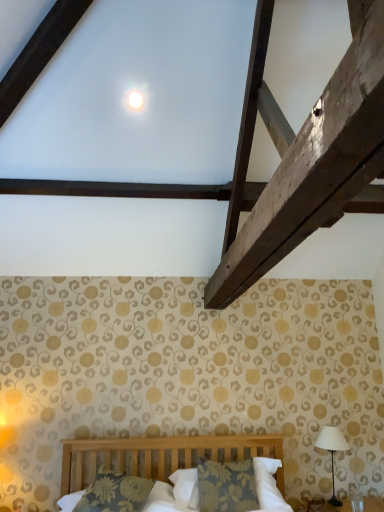
Question: Considering the relative sizes of white glossy moonlight at upper center and floral-patterned fabric pillow at center, the 1th pillow from the left, in the image provided, is white glossy moonlight at upper center wider than floral-patterned fabric pillow at center, the 1th pillow from the left,?

Choices:
 (A) yes
 (B) no

Answer: (B)

Question: Does white glossy moonlight at upper center have a smaller size compared to floral-patterned fabric pillow at center, positioned as the second pillow in right-to-left order?

Choices:
 (A) no
 (B) yes

Answer: (B)

Question: Is white glossy moonlight at upper center looking in the opposite direction of floral-patterned fabric pillow at center, positioned as the second pillow in right-to-left order?

Choices:
 (A) no
 (B) yes

Answer: (A)

Question: Is floral-patterned fabric pillow at center, positioned as the second pillow in right-to-left order, a part of white glossy moonlight at upper center?

Choices:
 (A) yes
 (B) no

Answer: (B)

Question: Is white glossy moonlight at upper center shorter than floral-patterned fabric pillow at center, positioned as the second pillow in right-to-left order?

Choices:
 (A) yes
 (B) no

Answer: (A)

Question: Considering the relative positions of white glossy moonlight at upper center and white fabric-covered lampshade at right in the image provided, is white glossy moonlight at upper center to the left or to the right of white fabric-covered lampshade at right?

Choices:
 (A) right
 (B) left

Answer: (B)

Question: Which is correct: white glossy moonlight at upper center is inside white fabric-covered lampshade at right, or outside of it?

Choices:
 (A) outside
 (B) inside

Answer: (A)

Question: Looking at the image, does white glossy moonlight at upper center seem bigger or smaller compared to white fabric-covered lampshade at right?

Choices:
 (A) small
 (B) big

Answer: (A)

Question: In terms of height, does white glossy moonlight at upper center look taller or shorter compared to white fabric-covered lampshade at right?

Choices:
 (A) tall
 (B) short

Answer: (B)

Question: From a real-world perspective, is white fabric-covered lampshade at right above or below floral fabric pillow at center, marked as the first pillow in a right-to-left arrangement?

Choices:
 (A) below
 (B) above

Answer: (B)

Question: Looking at the image, does white fabric-covered lampshade at right seem bigger or smaller compared to floral fabric pillow at center, marked as the first pillow in a right-to-left arrangement?

Choices:
 (A) small
 (B) big

Answer: (A)

Question: Is white fabric-covered lampshade at right taller or shorter than floral fabric pillow at center, marked as the first pillow in a right-to-left arrangement?

Choices:
 (A) tall
 (B) short

Answer: (A)

Question: Choose the correct answer: Is white fabric-covered lampshade at right inside floral fabric pillow at center, marked as the first pillow in a right-to-left arrangement, or outside it?

Choices:
 (A) inside
 (B) outside

Answer: (B)

Question: Considering the positions of floral-patterned fabric pillow at center, the 1th pillow from the left, and white glossy moonlight at upper center in the image, is floral-patterned fabric pillow at center, the 1th pillow from the left, bigger or smaller than white glossy moonlight at upper center?

Choices:
 (A) big
 (B) small

Answer: (A)

Question: Is floral-patterned fabric pillow at center, the 1th pillow from the left, inside or outside of white glossy moonlight at upper center?

Choices:
 (A) inside
 (B) outside

Answer: (B)